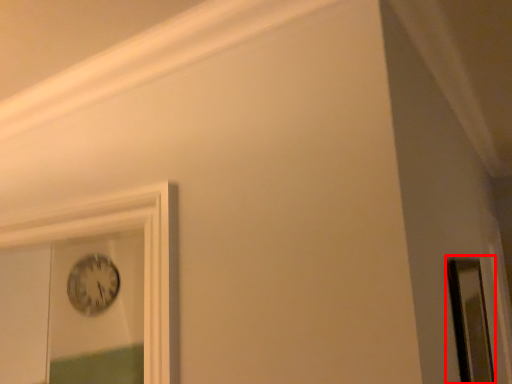
Question: Considering the relative positions of mirror (annotated by the red box) and clock in the image provided, where is mirror (annotated by the red box) located with respect to the staircase?

Choices:
 (A) left
 (B) right

Answer: (B)